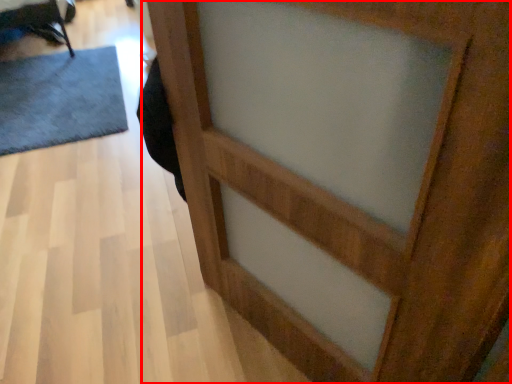
Question: From the image's perspective, what is the correct spatial positioning of barn door (annotated by the red box) in reference to doormat?

Choices:
 (A) below
 (B) above

Answer: (A)